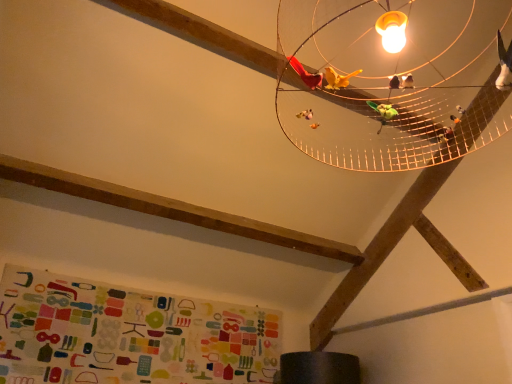
Question: From the image's perspective, is metallic wire mesh at upper center above multicolored fabric bulletin board at lower left?

Choices:
 (A) no
 (B) yes

Answer: (B)

Question: Is metallic wire mesh at upper center not inside multicolored fabric bulletin board at lower left?

Choices:
 (A) yes
 (B) no

Answer: (A)

Question: From the image's perspective, does metallic wire mesh at upper center appear lower than multicolored fabric bulletin board at lower left?

Choices:
 (A) yes
 (B) no

Answer: (B)

Question: Is metallic wire mesh at upper center placed right next to multicolored fabric bulletin board at lower left?

Choices:
 (A) yes
 (B) no

Answer: (B)

Question: Is there a large distance between metallic wire mesh at upper center and multicolored fabric bulletin board at lower left?

Choices:
 (A) no
 (B) yes

Answer: (B)

Question: Does metallic wire mesh at upper center turn towards multicolored fabric bulletin board at lower left?

Choices:
 (A) yes
 (B) no

Answer: (B)

Question: Could metallic wire mesh at upper center be considered to be inside multicolored fabric bulletin board at lower left?

Choices:
 (A) yes
 (B) no

Answer: (B)

Question: Is multicolored fabric bulletin board at lower left far away from metallic wire mesh at upper center?

Choices:
 (A) no
 (B) yes

Answer: (B)

Question: Is multicolored fabric bulletin board at lower left positioned with its back to metallic wire mesh at upper center?

Choices:
 (A) no
 (B) yes

Answer: (A)

Question: Can you confirm if multicolored fabric bulletin board at lower left is positioned to the right of metallic wire mesh at upper center?

Choices:
 (A) yes
 (B) no

Answer: (B)

Question: Is multicolored fabric bulletin board at lower left outside of metallic wire mesh at upper center?

Choices:
 (A) yes
 (B) no

Answer: (A)

Question: Is multicolored fabric bulletin board at lower left thinner than metallic wire mesh at upper center?

Choices:
 (A) yes
 (B) no

Answer: (A)

Question: From the image's perspective, is metallic wire mesh at upper center located above or below multicolored fabric bulletin board at lower left?

Choices:
 (A) below
 (B) above

Answer: (B)